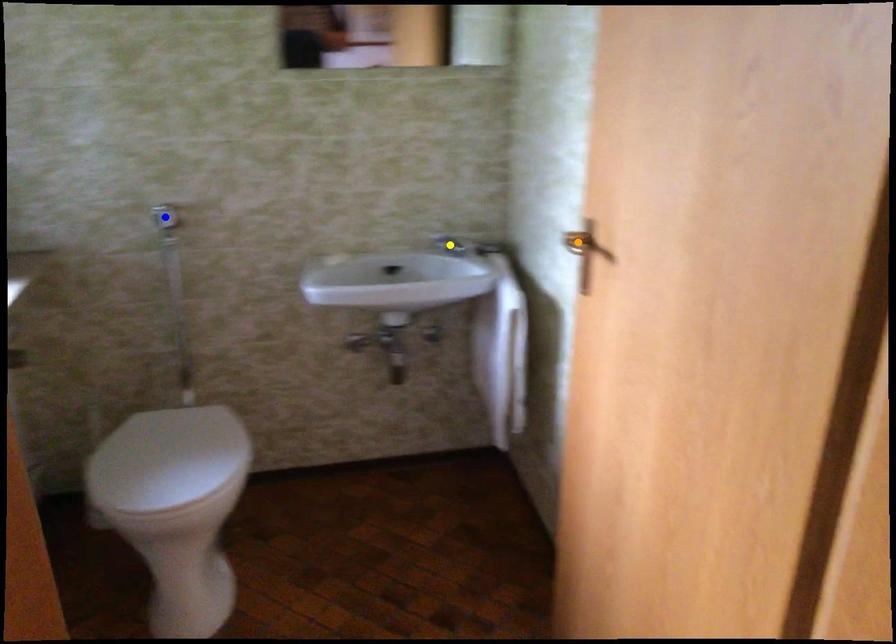
Order these from nearest to farthest:
A) yellow point
B) blue point
C) orange point

orange point
blue point
yellow point